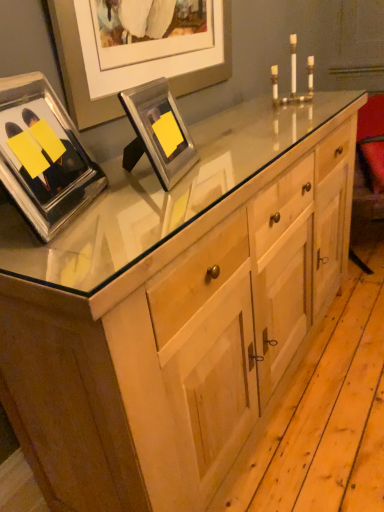
Where is `vacant area situated below gold metallic candle holder at upper center (from a real-world perspective)`? This screenshot has width=384, height=512. vacant area situated below gold metallic candle holder at upper center (from a real-world perspective) is located at coordinates (294, 106).